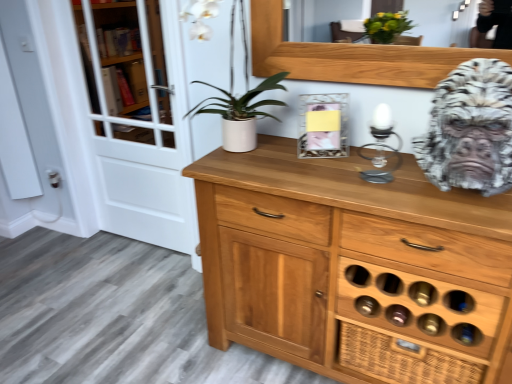
The height and width of the screenshot is (384, 512). Describe the element at coordinates (470, 129) in the screenshot. I see `white marble gorilla head at right` at that location.

Identify the location of white marble gorilla head at right. The image size is (512, 384). (470, 129).

What do you see at coordinates (138, 120) in the screenshot? This screenshot has height=384, width=512. I see `white glass screen door at left` at bounding box center [138, 120].

What do you see at coordinates (381, 147) in the screenshot? The width and height of the screenshot is (512, 384). I see `clear glass candle holder at center` at bounding box center [381, 147].

Identify the location of white marble gorilla head at right. (470, 129).

Considering the sizes of white glass screen door at left and clear glass candle holder at center in the image, is white glass screen door at left bigger or smaller than clear glass candle holder at center?

Clearly, white glass screen door at left is larger in size than clear glass candle holder at center.

Consider the image. From a real-world perspective, which object stands above the other?

In real-world perspective, clear glass candle holder at center is above.

In terms of height, does white glass screen door at left look taller or shorter compared to clear glass candle holder at center?

white glass screen door at left is taller than clear glass candle holder at center.

Between point (135, 196) and point (361, 146), which one is positioned in front?

Positioned in front is point (361, 146).

Does white marble gorilla head at right come in front of white glass screen door at left?

Yes, it is in front of white glass screen door at left.

Considering the points (449, 105) and (151, 0), which point is in front, point (449, 105) or point (151, 0)?

Point (449, 105)

From the image's perspective, which is above, white marble gorilla head at right or white glass screen door at left?

white glass screen door at left is shown above in the image.

Could you tell me if white marble gorilla head at right is turned towards white glass screen door at left?

No, white marble gorilla head at right is not facing towards white glass screen door at left.

From the image's perspective, which is above, white marble gorilla head at right or clear glass candle holder at center?

white marble gorilla head at right appears higher in the image.

Which of these two, white marble gorilla head at right or clear glass candle holder at center, is smaller?

With smaller size is clear glass candle holder at center.

Can you confirm if white marble gorilla head at right is wider than clear glass candle holder at center?

Yes.

From the image's perspective, which is below, clear glass candle holder at center or white matte pot at center?

clear glass candle holder at center, from the image's perspective.

Does point (399, 153) appear closer or farther from the camera than point (229, 106)?

Point (399, 153) is positioned closer to the camera compared to point (229, 106).

Could white matte pot at center be considered to be inside clear glass candle holder at center?

No.

Can you tell me how much clear glass candle holder at center and white matte pot at center differ in facing direction?

clear glass candle holder at center and white matte pot at center are facing 1.2 degrees away from each other.

From the image's perspective, is white matte pot at center above or below white glass screen door at left?

white matte pot at center is above white glass screen door at left.

Considering the relative positions of white matte pot at center and white glass screen door at left in the image provided, is white matte pot at center behind white glass screen door at left?

No, it is in front of white glass screen door at left.

Is white glass screen door at left at the back of white matte pot at center?

No, white matte pot at center is not facing the opposite direction of white glass screen door at left.

Is white matte pot at center next to white glass screen door at left and touching it?

white matte pot at center is not next to white glass screen door at left, and they're not touching.

There is a clear glass candle holder at center. Where is `gorilla above it (from a real-world perspective)`? The height and width of the screenshot is (384, 512). gorilla above it (from a real-world perspective) is located at coordinates click(x=470, y=129).

Which object is wider, clear glass candle holder at center or white marble gorilla head at right?

With larger width is white marble gorilla head at right.

Is clear glass candle holder at center at the right side of white marble gorilla head at right?

Incorrect, clear glass candle holder at center is not on the right side of white marble gorilla head at right.

From a real-world perspective, between clear glass candle holder at center and white marble gorilla head at right, who is vertically higher?

white marble gorilla head at right, from a real-world perspective.

Locate an element on the screen. plant above the white marble gorilla head at right (from the image's perspective) is located at coordinates (240, 96).

From a real-world perspective, is white marble gorilla head at right under white matte pot at center?

Yes.

Can white matte pot at center be found inside white marble gorilla head at right?

Actually, white matte pot at center is outside white marble gorilla head at right.

From the picture: Relative to white matte pot at center, is white marble gorilla head at right in front or behind?

white marble gorilla head at right is in front of white matte pot at center.

Where is `screen door behind the clear glass candle holder at center`? This screenshot has height=384, width=512. screen door behind the clear glass candle holder at center is located at coordinates (138, 120).

Image resolution: width=512 pixels, height=384 pixels. I want to click on gorilla on the right of white glass screen door at left, so click(x=470, y=129).

Based on their spatial positions, is clear glass candle holder at center or white glass screen door at left closer to white matte pot at center?

Among the two, white glass screen door at left is located nearer to white matte pot at center.

Considering their positions, is white glass screen door at left positioned further to white marble gorilla head at right than clear glass candle holder at center?

Based on the image, white glass screen door at left appears to be further to white marble gorilla head at right.

Which object lies nearer to the anchor point white matte pot at center, white glass screen door at left or clear glass candle holder at center?

white glass screen door at left lies closer to white matte pot at center than the other object.

When comparing their distances from clear glass candle holder at center, does white glass screen door at left or white marble gorilla head at right seem closer?

white marble gorilla head at right.

Considering their positions, is white marble gorilla head at right positioned further to clear glass candle holder at center than white matte pot at center?

white matte pot at center is further to clear glass candle holder at center.

Estimate the real-world distances between objects in this image. Which object is closer to white glass screen door at left, white marble gorilla head at right or white matte pot at center?

Among the two, white matte pot at center is located nearer to white glass screen door at left.

Based on the photo, looking at the image, which one is located closer to clear glass candle holder at center, white marble gorilla head at right or white glass screen door at left?

white marble gorilla head at right is closer to clear glass candle holder at center.

Considering their positions, is white matte pot at center positioned further to clear glass candle holder at center than white marble gorilla head at right?

Among the two, white matte pot at center is located further to clear glass candle holder at center.

Where is `plant between white glass screen door at left and white marble gorilla head at right`? This screenshot has height=384, width=512. plant between white glass screen door at left and white marble gorilla head at right is located at coordinates (240, 96).

Identify the location of candle holder between white matte pot at center and white marble gorilla head at right in the horizontal direction. The height and width of the screenshot is (384, 512). (381, 147).

At what (x,y) coordinates should I click in order to perform the action: click on plant between white glass screen door at left and clear glass candle holder at center. Please return your answer as a coordinate pair (x, y). The width and height of the screenshot is (512, 384). Looking at the image, I should click on (240, 96).

Find the location of a particular element. The image size is (512, 384). candle holder situated between white glass screen door at left and white marble gorilla head at right from left to right is located at coordinates (381, 147).